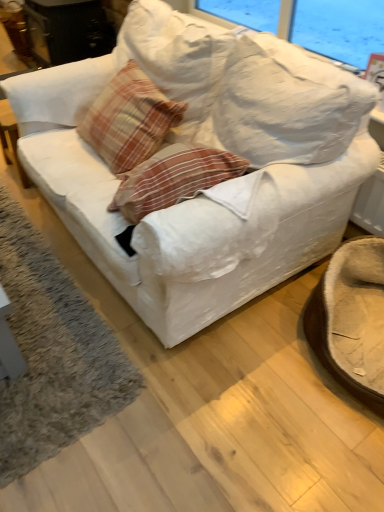
At what (x,y) coordinates should I click in order to perform the action: click on blank space above soft gray carpet at lower left (from a real-world perspective). Please return your answer as a coordinate pair (x, y). Looking at the image, I should click on (31, 295).